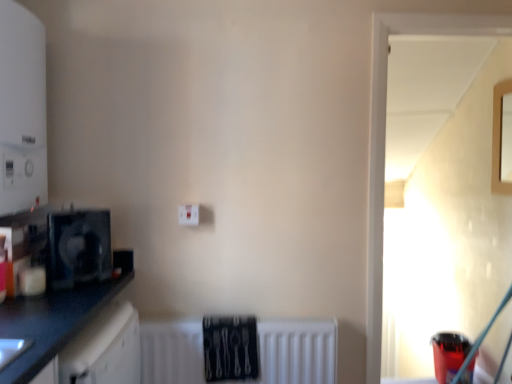
The width and height of the screenshot is (512, 384). What do you see at coordinates (449, 354) in the screenshot?
I see `translucent plastic cup at lower right, the 2th appliance viewed from the top` at bounding box center [449, 354].

What is the approximate width of transparent glass door at upper right, the first window from the left?

transparent glass door at upper right, the first window from the left, is 12.86 centimeters wide.

What do you see at coordinates (502, 138) in the screenshot?
I see `wooden frame at upper right, marked as the 1th window in a right-to-left arrangement` at bounding box center [502, 138].

Locate an element on the screen. The height and width of the screenshot is (384, 512). white matte radiator at lower center is located at coordinates (296, 352).

Locate an element on the screen. Image resolution: width=512 pixels, height=384 pixels. translucent plastic cup at lower right, the 2th appliance viewed from the top is located at coordinates [449, 354].

Is point (378, 141) less distant than point (76, 303)?

That is False.

The height and width of the screenshot is (384, 512). In order to click on countertop lying below the transparent glass door at upper right, which is counted as the 2th window, starting from the right (from the image's perspective) in this screenshot , I will do `click(52, 322)`.

How different are the orientations of transparent glass door at upper right, arranged as the first window when viewed from the front, and black matte countertop at left in degrees?

The angular difference between transparent glass door at upper right, arranged as the first window when viewed from the front, and black matte countertop at left is 90 degrees.

Can you confirm if transparent glass door at upper right, placed as the 2th window when sorted from back to front, is smaller than black matte countertop at left?

Correct, transparent glass door at upper right, placed as the 2th window when sorted from back to front, occupies less space than black matte countertop at left.

From a real-world perspective, is white matte radiator at lower center beneath wooden frame at upper right, marked as the 1th window in a right-to-left arrangement?

Indeed, from a real-world perspective, white matte radiator at lower center is positioned beneath wooden frame at upper right, marked as the 1th window in a right-to-left arrangement.

Looking at this image, considering the relative sizes of white matte radiator at lower center and wooden frame at upper right, which appears as the 2th window when viewed from the front, in the image provided, is white matte radiator at lower center taller than wooden frame at upper right, which appears as the 2th window when viewed from the front,?

Incorrect, the height of white matte radiator at lower center is not larger of that of wooden frame at upper right, which appears as the 2th window when viewed from the front.

Is white matte radiator at lower center located outside wooden frame at upper right, which appears as the 2th window when viewed from the front?

Absolutely, white matte radiator at lower center is external to wooden frame at upper right, which appears as the 2th window when viewed from the front.

The height and width of the screenshot is (384, 512). I want to click on radiator below the wooden frame at upper right, marked as the 1th window in a right-to-left arrangement (from the image's perspective), so click(296, 352).

Is translucent plastic cup at lower right, the 2th appliance viewed from the top, to the left of white plastic electric outlet at center from the viewer's perspective?

No.

Is translucent plastic cup at lower right, which is the first appliance in bottom-to-top order, in contact with white plastic electric outlet at center?

No, translucent plastic cup at lower right, which is the first appliance in bottom-to-top order, is not in contact with white plastic electric outlet at center.

Does translucent plastic cup at lower right, which ranks as the second appliance in front-to-back order, have a lesser height compared to white plastic electric outlet at center?

No, translucent plastic cup at lower right, which ranks as the second appliance in front-to-back order, is not shorter than white plastic electric outlet at center.

Considering the relative sizes of translucent plastic cup at lower right, which is the first appliance in bottom-to-top order, and white plastic electric outlet at center in the image provided, is translucent plastic cup at lower right, which is the first appliance in bottom-to-top order, smaller than white plastic electric outlet at center?

No, translucent plastic cup at lower right, which is the first appliance in bottom-to-top order, is not smaller than white plastic electric outlet at center.

From the image's perspective, does white matte radiator at lower center appear higher than black plastic fan at left, which is the second appliance from right to left?

No, from the image's perspective, white matte radiator at lower center is not above black plastic fan at left, which is the second appliance from right to left.

From the picture: Could you tell me if white matte radiator at lower center is facing black plastic fan at left, the 1th appliance in the front-to-back sequence?

No, white matte radiator at lower center is not aimed at black plastic fan at left, the 1th appliance in the front-to-back sequence.

Which object is more forward, white matte radiator at lower center or black plastic fan at left, which is the second appliance from right to left?

black plastic fan at left, which is the second appliance from right to left.

Looking at the image, does white matte radiator at lower center seem bigger or smaller compared to black plastic fan at left, the 1th appliance in the left-to-right sequence?

Clearly, white matte radiator at lower center is larger in size than black plastic fan at left, the 1th appliance in the left-to-right sequence.

From a real-world perspective, which window is the 2nd one above the white matte radiator at lower center? Please provide its 2D coordinates.

[(502, 138)]

Does wooden frame at upper right, which appears as the 2th window when viewed from the left, come in front of white matte radiator at lower center?

No, it is not.

Measure the distance from wooden frame at upper right, marked as the 1th window in a right-to-left arrangement, to white matte radiator at lower center.

They are 5.14 feet apart.

From a real-world perspective, which is physically above, wooden frame at upper right, marked as the 1th window in a right-to-left arrangement, or white matte radiator at lower center?

wooden frame at upper right, marked as the 1th window in a right-to-left arrangement, is physically above.

You are a GUI agent. You are given a task and a screenshot of the screen. Output one action in this format:
    pyautogui.click(x=<x>, y=<y>)
    Task: Click on the radiator above the translucent plastic cup at lower right, which is the first appliance in bottom-to-top order (from a real-world perspective)
    Image resolution: width=512 pixels, height=384 pixels.
    Given the screenshot: What is the action you would take?
    pyautogui.click(x=296, y=352)

Is translucent plastic cup at lower right, which ranks as the second appliance in front-to-back order, directly adjacent to white matte radiator at lower center?

No, translucent plastic cup at lower right, which ranks as the second appliance in front-to-back order, is not next to white matte radiator at lower center.

From a real-world perspective, is translucent plastic cup at lower right, the 2th appliance viewed from the top, physically above white matte radiator at lower center?

Incorrect, from a real-world perspective, translucent plastic cup at lower right, the 2th appliance viewed from the top, is lower than white matte radiator at lower center.

Is translucent plastic cup at lower right, acting as the 1th appliance starting from the right, touching black plastic fan at left, which ranks as the 1th appliance in top-to-bottom order?

No, translucent plastic cup at lower right, acting as the 1th appliance starting from the right, is not touching black plastic fan at left, which ranks as the 1th appliance in top-to-bottom order.

Who is bigger, translucent plastic cup at lower right, acting as the 1th appliance starting from the right, or black plastic fan at left, the 1th appliance in the left-to-right sequence?

translucent plastic cup at lower right, acting as the 1th appliance starting from the right.

Considering the sizes of objects translucent plastic cup at lower right, acting as the 1th appliance starting from the back, and black plastic fan at left, arranged as the 2th appliance when viewed from the back, in the image provided, who is wider, translucent plastic cup at lower right, acting as the 1th appliance starting from the back, or black plastic fan at left, arranged as the 2th appliance when viewed from the back,?

Wider between the two is translucent plastic cup at lower right, acting as the 1th appliance starting from the back.

Between translucent plastic cup at lower right, which is the 2th appliance in left-to-right order, and black plastic fan at left, the 1th appliance in the front-to-back sequence, which one appears on the right side from the viewer's perspective?

From the viewer's perspective, translucent plastic cup at lower right, which is the 2th appliance in left-to-right order, appears more on the right side.

Locate an element on the screen. the 1st window behind the black matte countertop at left, starting your count from the anchor is located at coordinates (384, 144).

Locate an element on the screen. the 2nd window directly above the white matte radiator at lower center (from a real-world perspective) is located at coordinates (502, 138).

Which object lies nearer to the anchor point white plastic electric outlet at center, transparent glass door at upper right, placed as the 2th window when sorted from back to front, or translucent plastic cup at lower right, which is the first appliance in bottom-to-top order?

The object closer to white plastic electric outlet at center is transparent glass door at upper right, placed as the 2th window when sorted from back to front.

When comparing their distances from black matte countertop at left, does black plastic fan at left, the 2th appliance positioned from the bottom, or white plastic electric outlet at center seem closer?

Based on the image, black plastic fan at left, the 2th appliance positioned from the bottom, appears to be nearer to black matte countertop at left.

Which object lies further to the anchor point black plastic fan at left, arranged as the 2th appliance when viewed from the back, wooden frame at upper right, the first window positioned from the back, or black matte countertop at left?

wooden frame at upper right, the first window positioned from the back, is positioned further to the anchor black plastic fan at left, arranged as the 2th appliance when viewed from the back.

Estimate the real-world distances between objects in this image. Which object is further from translucent plastic cup at lower right, acting as the 1th appliance starting from the back, black plastic fan at left, arranged as the 2th appliance when viewed from the back, or transparent glass door at upper right, which is counted as the 2th window, starting from the right?

The object further to translucent plastic cup at lower right, acting as the 1th appliance starting from the back, is black plastic fan at left, arranged as the 2th appliance when viewed from the back.

When comparing their distances from black matte countertop at left, does transparent glass door at upper right, the first window from the left, or black plastic fan at left, which is the second appliance from right to left, seem further?

transparent glass door at upper right, the first window from the left.

Estimate the real-world distances between objects in this image. Which object is further from white matte radiator at lower center, transparent glass door at upper right, the first window from the left, or wooden frame at upper right, the first window positioned from the back?

wooden frame at upper right, the first window positioned from the back, lies further to white matte radiator at lower center than the other object.

Based on their spatial positions, is white plastic electric outlet at center or white matte radiator at lower center closer to wooden frame at upper right, marked as the 1th window in a right-to-left arrangement?

Based on the image, white matte radiator at lower center appears to be nearer to wooden frame at upper right, marked as the 1th window in a right-to-left arrangement.

From the image, which object appears to be farther from transparent glass door at upper right, placed as the 2th window when sorted from back to front, black matte countertop at left or translucent plastic cup at lower right, which is the 2th appliance in left-to-right order?

black matte countertop at left lies further to transparent glass door at upper right, placed as the 2th window when sorted from back to front, than the other object.

The image size is (512, 384). I want to click on electric outlet between black plastic fan at left, the 1th appliance in the left-to-right sequence, and wooden frame at upper right, the first window positioned from the back, from left to right, so click(189, 214).

Locate an element on the screen. The height and width of the screenshot is (384, 512). window between white matte radiator at lower center and wooden frame at upper right, marked as the 1th window in a right-to-left arrangement, from left to right is located at coordinates (384, 144).

This screenshot has height=384, width=512. I want to click on radiator between black matte countertop at left and translucent plastic cup at lower right, which ranks as the second appliance in front-to-back order, in the horizontal direction, so pos(296,352).

This screenshot has width=512, height=384. Find the location of `electric outlet between black matte countertop at left and white matte radiator at lower center from left to right`. electric outlet between black matte countertop at left and white matte radiator at lower center from left to right is located at coordinates (189, 214).